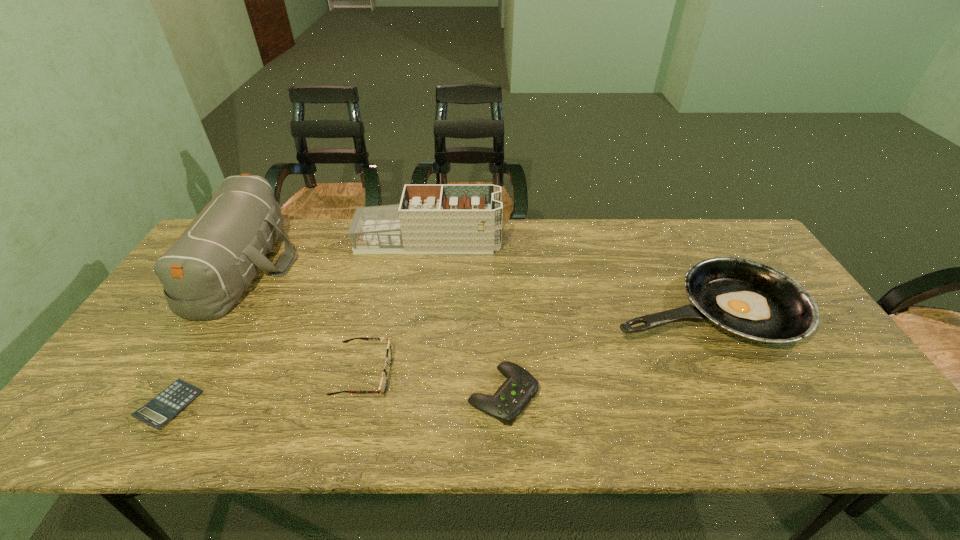
Where is `free area in between the dollhouse and the fifth tallest object`? This screenshot has height=540, width=960. free area in between the dollhouse and the fifth tallest object is located at coordinates (466, 318).

Image resolution: width=960 pixels, height=540 pixels. What are the coordinates of `unoccupied area between the shortest object and the frying pan` in the screenshot? It's located at (437, 357).

You are a GUI agent. You are given a task and a screenshot of the screen. Output one action in this format:
    pyautogui.click(x=<x>, y=<y>)
    Task: Click on the empty location between the duffel bag and the calculator
    The image size is (960, 540).
    Given the screenshot: What is the action you would take?
    pyautogui.click(x=207, y=335)

The height and width of the screenshot is (540, 960). I want to click on empty space that is in between the frying pan and the fifth shortest object, so click(x=566, y=275).

You are a GUI agent. You are given a task and a screenshot of the screen. Output one action in this format:
    pyautogui.click(x=<x>, y=<y>)
    Task: Click on the unoccupied area between the third shortest object and the duffel bag
    
    Given the screenshot: What is the action you would take?
    coord(304,320)

Identify the location of free space between the third shortest object and the calculator. coord(267,390).

Identify the location of free space between the fifth tallest object and the duffel bag. The image size is (960, 540). (374, 330).

You are a GUI agent. You are given a task and a screenshot of the screen. Output one action in this format:
    pyautogui.click(x=<x>, y=<y>)
    Task: Click on the free space that is in between the third shortest object and the fifth tallest object
    The height and width of the screenshot is (540, 960).
    Given the screenshot: What is the action you would take?
    pyautogui.click(x=433, y=384)

Identify the location of object that stands as the second closest to the fifth tallest object. The image size is (960, 540). (747, 299).

Locate which object is the fourth closest to the control. Please provide its 2D coordinates. Your answer should be formatted as a tuple, i.e. [(x, y)], where the tuple contains the x and y coordinates of a point satisfying the conditions above.

[(204, 273)]